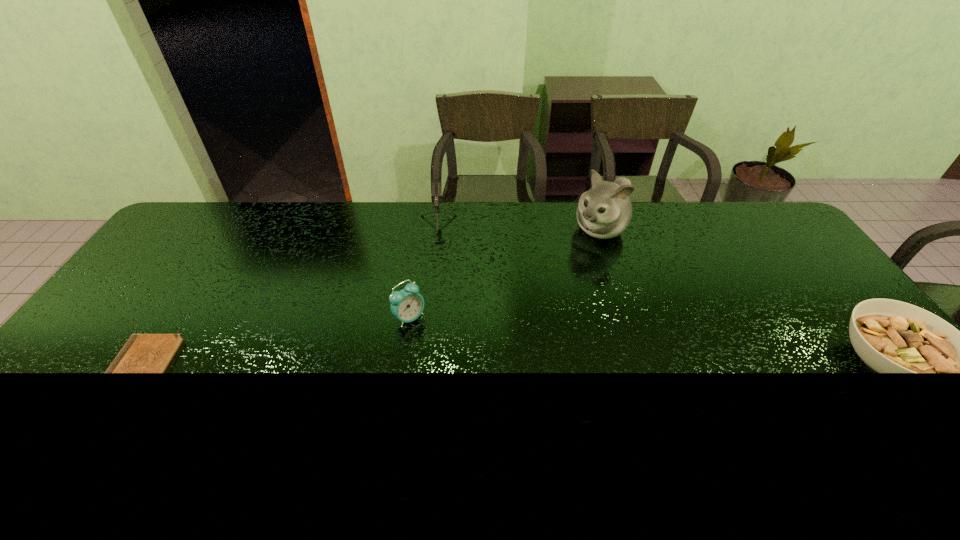
You are a GUI agent. You are given a task and a screenshot of the screen. Output one action in this format:
    pyautogui.click(x=<x>, y=<y>)
    Task: Click on the vacant spot on the desktop that is between the diary and the rightmost object and is positioned on the stand of the microphone
    This screenshot has height=540, width=960.
    Given the screenshot: What is the action you would take?
    pyautogui.click(x=423, y=366)

The image size is (960, 540). I want to click on free spot on the desktop that is between the diary and the rightmost object and is positioned on the face of the tallest object, so click(463, 366).

The height and width of the screenshot is (540, 960). Find the location of `free space on the desktop that is between the shortest object and the rightmost object and is positioned on the face of the alarm clock`. free space on the desktop that is between the shortest object and the rightmost object and is positioned on the face of the alarm clock is located at coordinates (488, 366).